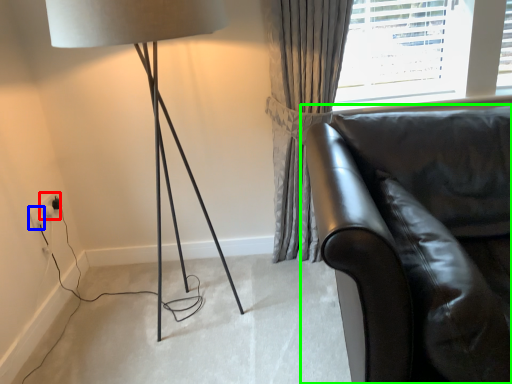
Question: Considering the real-world distances, which object is farthest from electric outlet (highlighted by a red box)? electric outlet (highlighted by a blue box) or studio couch (highlighted by a green box)?

Choices:
 (A) electric outlet
 (B) studio couch

Answer: (B)